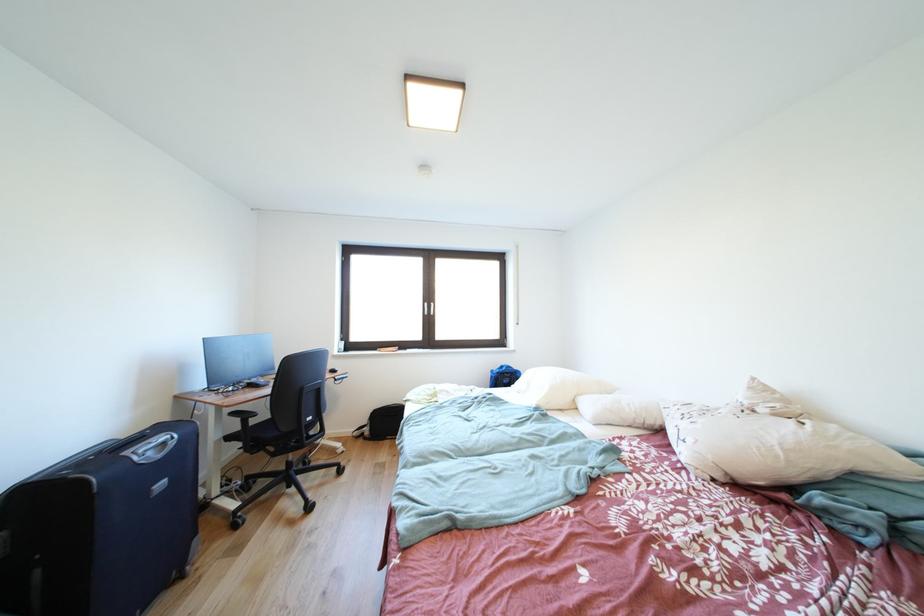
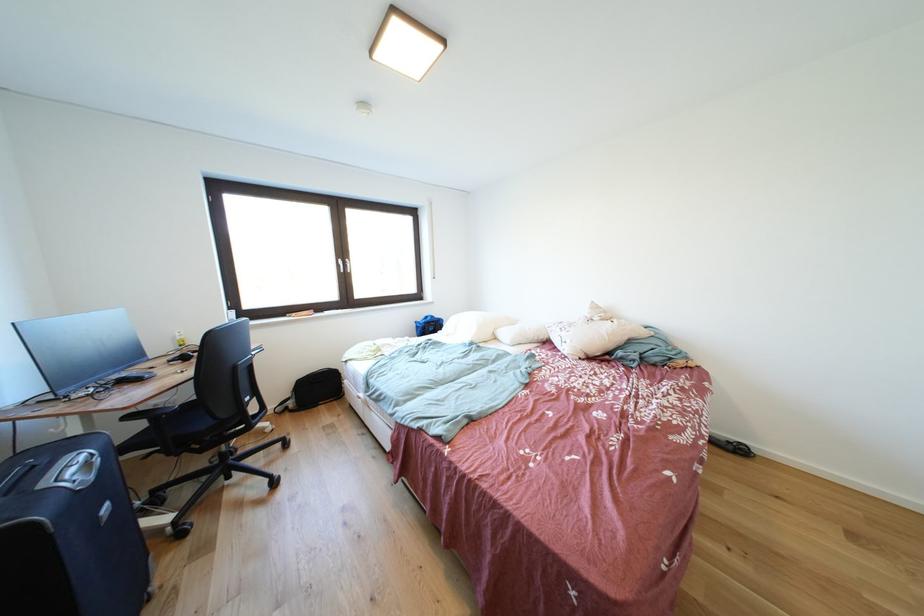
In the second image, find the point that corresponds to (x=434, y=310) in the first image.

(348, 265)